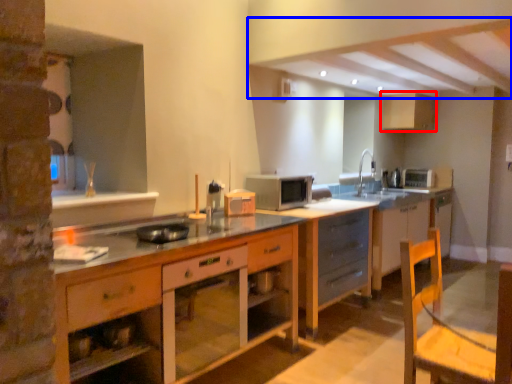
Question: Among these objects, which one is farthest to the camera, cabinetry (highlighted by a red box) or exhaust hood (highlighted by a blue box)?

Choices:
 (A) cabinetry
 (B) exhaust hood

Answer: (A)